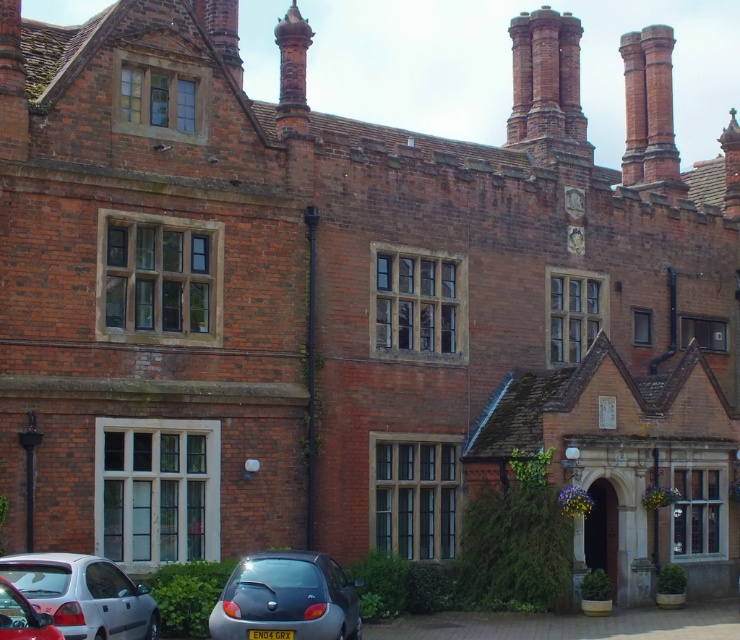
You are a delivery person standing next to the metallic silver car at lower left, and you need to deliver a package to the red brick chimney at upper right. The delivery robot you use has a maximum range of 50 meters. Can the robot reach the chimney from your current position?

The distance between the red brick chimney at upper right and the metallic silver car at lower left is 46.33 meters, which is within the robot

You are a delivery person who needs to park a van that is 2 meters tall. You see two cars parked at the lower left of the image, a metallic gray car at lower left and a metallic silver car at lower left. Which car is shorter and can you park your van behind it without hitting the roof?

The metallic gray car at lower left has a lesser height compared to the metallic silver car at lower left. Since the van is 2 meters tall, you should check the height of the metallic gray car. If it is shorter than 2 meters, you can park behind it. However, if it is taller, you might need to look for another spot.